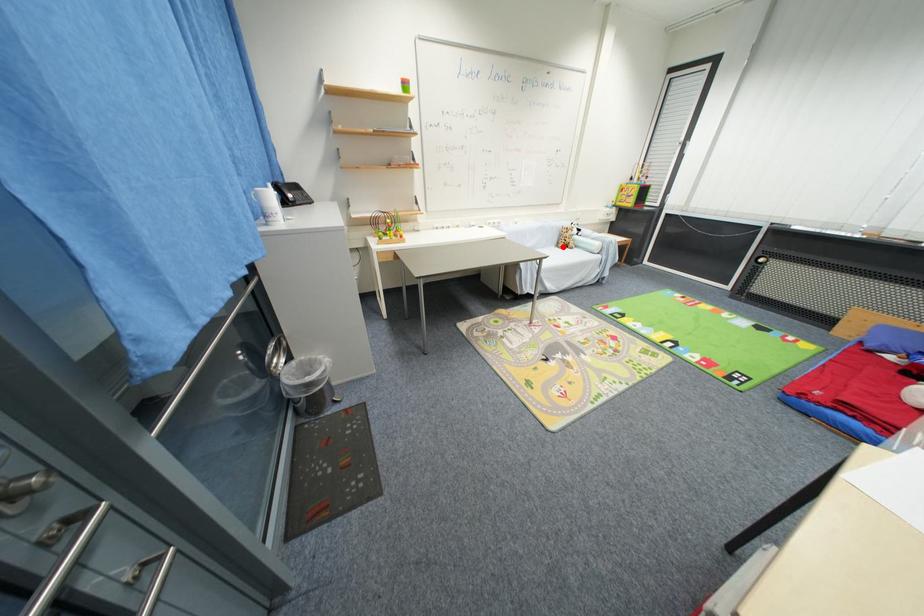
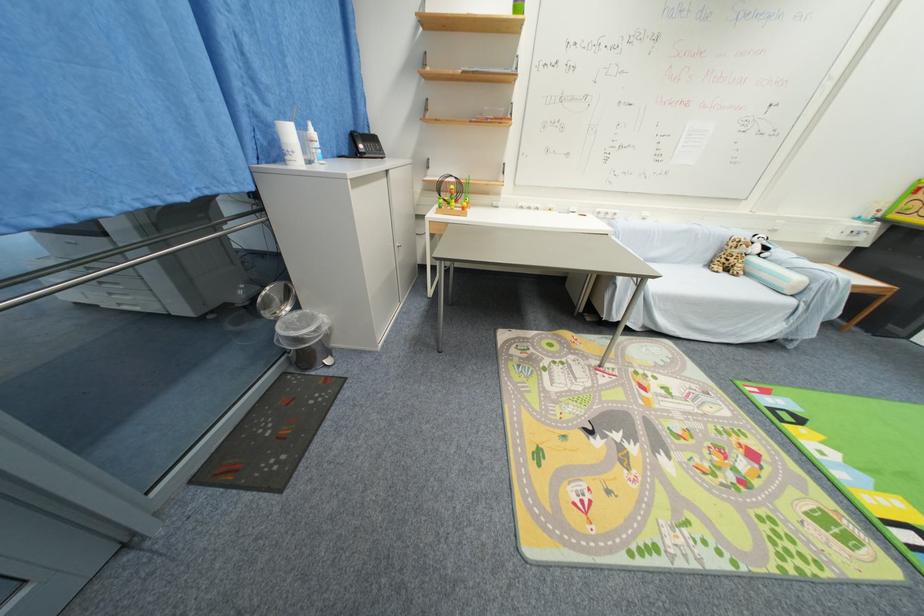
Question: A red point is marked in image1. In image2, is the corresponding 3D point closer to the camera or farther? Reply with the corresponding letter.

Choices:
 (A) The corresponding 3D point is closer.
 (B) The corresponding 3D point is farther.

Answer: (A)